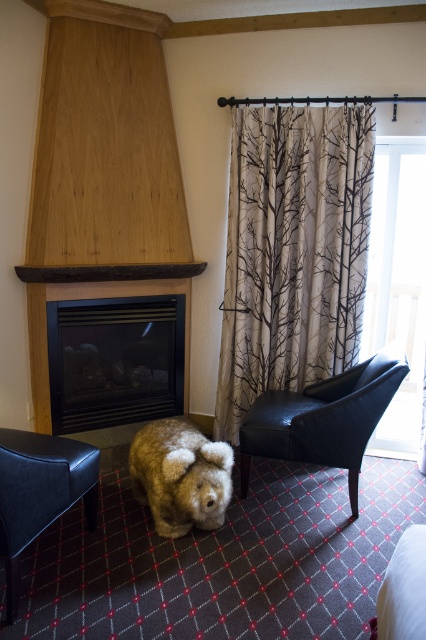
You are standing at the entrance of the room and want to move towards the leather armchair at lower left. According to the coordinates provided, in which direction should you move from your current position?

The leather armchair at lower left is located at coordinates point (40, 492), so you should move towards the lower left direction from your current position at the entrance.

You are standing in the living room and want to move from the leather armchair at lower left to the window. The black glass fireplace at center is in your way. Can you go around it to reach the window?

The black glass fireplace at center is to the right of the leather armchair at lower left, so you can go around the left side of the fireplace to reach the window.

You are a guest in this room and want to place a new decorative pillow on the seat of the leather armchair at lower left. However, you notice the fuzzy brown stuffed animal at lower center is already occupying part of the seat. Can the pillow fit next to the stuffed animal?

The leather armchair at lower left is positioned on the left side of the fuzzy brown stuffed animal at lower center, so the stuffed animal is on the right side of the chair. There should be enough space on the left side of the stuffed animal to place the pillow next to it.